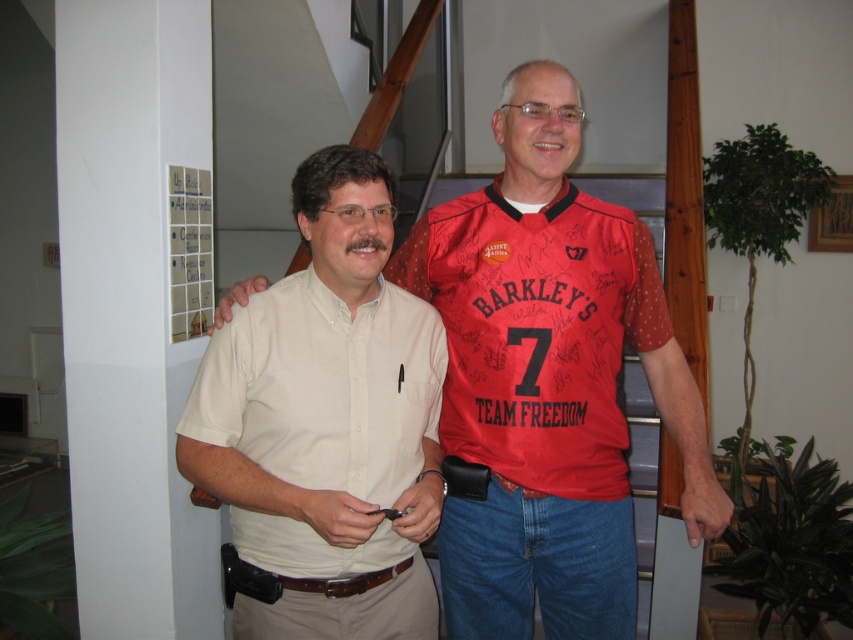
Question: Which of the following is the farthest from the observer?

Choices:
 (A) red jersey at center
 (B) blue carpeted stairs at center
 (C) matte white shirt at center

Answer: (B)

Question: Can you confirm if red jersey at center is thinner than blue carpeted stairs at center?

Choices:
 (A) yes
 (B) no

Answer: (B)

Question: Which is nearer to the matte white shirt at center?

Choices:
 (A) beige cotton shirt at center
 (B) red jersey at center

Answer: (B)

Question: Observing the image, what is the correct spatial positioning of beige cotton shirt at center in reference to blue carpeted stairs at center?

Choices:
 (A) left
 (B) right

Answer: (A)

Question: Does red jersey at center appear on the right side of beige cotton shirt at center?

Choices:
 (A) yes
 (B) no

Answer: (A)

Question: Which object is positioned farthest from the blue carpeted stairs at center?

Choices:
 (A) beige cotton shirt at center
 (B) red jersey at center

Answer: (A)